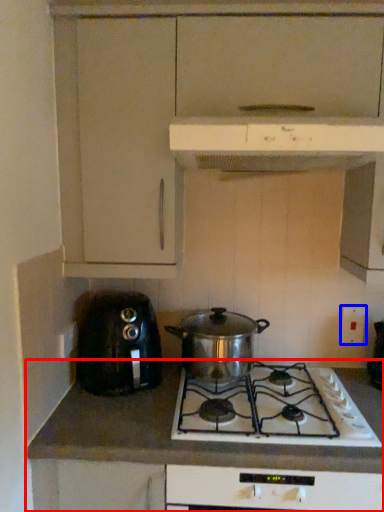
Question: Which object is further to the camera taking this photo, countertop (highlighted by a red box) or electric outlet (highlighted by a blue box)?

Choices:
 (A) countertop
 (B) electric outlet

Answer: (B)